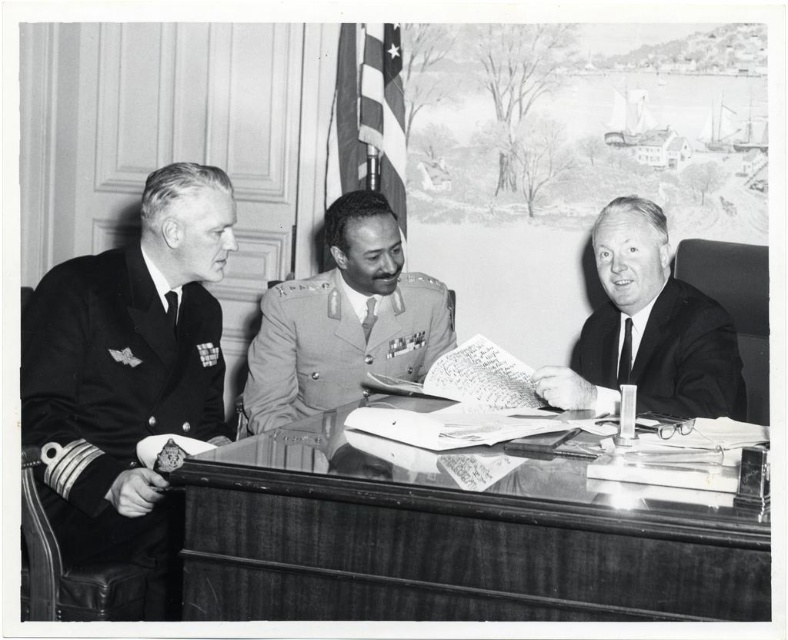
Question: Can you confirm if uniformed officer at left is smaller than smooth black suit at center?

Choices:
 (A) no
 (B) yes

Answer: (A)

Question: Is uniformed officer at left to the left of smooth black suit at center from the viewer's perspective?

Choices:
 (A) no
 (B) yes

Answer: (B)

Question: Which point appears farthest from the camera in this image?

Choices:
 (A) (619, 522)
 (B) (558, 371)

Answer: (B)

Question: Which of these objects is positioned farthest from the uniform at center?

Choices:
 (A) wooden table at center
 (B) uniformed officer at left
 (C) smooth black suit at center

Answer: (A)

Question: Is uniformed officer at left below smooth black suit at center?

Choices:
 (A) no
 (B) yes

Answer: (A)

Question: Which of the following is the closest to the observer?

Choices:
 (A) wooden table at center
 (B) smooth black suit at center
 (C) uniformed officer at left

Answer: (A)